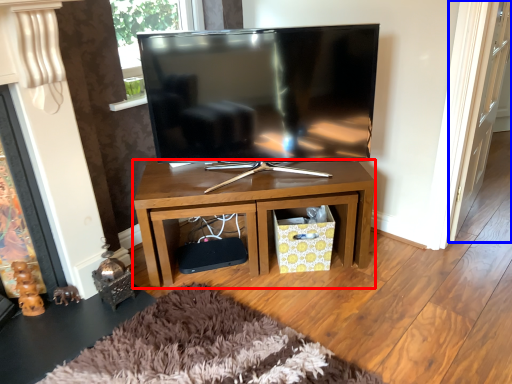
Question: Which point is further to the camera, desk (highlighted by a red box) or glass door (highlighted by a blue box)?

Choices:
 (A) desk
 (B) glass door

Answer: (A)